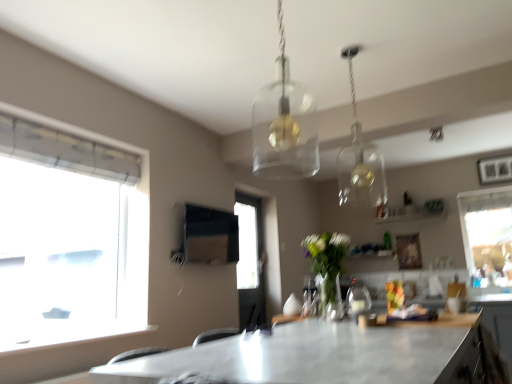
Question: Is transparent glass window at right positioned beyond the bounds of clear glass vase at center?

Choices:
 (A) no
 (B) yes

Answer: (B)

Question: Is transparent glass window at right positioned behind clear glass vase at center?

Choices:
 (A) no
 (B) yes

Answer: (B)

Question: From a real-world perspective, is transparent glass window at right over clear glass vase at center?

Choices:
 (A) no
 (B) yes

Answer: (B)

Question: Does transparent glass window at right have a greater width compared to clear glass vase at center?

Choices:
 (A) no
 (B) yes

Answer: (A)

Question: From the image's perspective, is transparent glass window at right below clear glass vase at center?

Choices:
 (A) no
 (B) yes

Answer: (B)

Question: Relative to metallic gray table at center, is matte black cabinet at lower right in front or behind?

Choices:
 (A) front
 (B) behind

Answer: (B)

Question: Considering the positions of matte black cabinet at lower right and metallic gray table at center in the image, is matte black cabinet at lower right bigger or smaller than metallic gray table at center?

Choices:
 (A) big
 (B) small

Answer: (B)

Question: In terms of width, does matte black cabinet at lower right look wider or thinner when compared to metallic gray table at center?

Choices:
 (A) wide
 (B) thin

Answer: (B)

Question: Is matte black cabinet at lower right inside or outside of metallic gray table at center?

Choices:
 (A) inside
 (B) outside

Answer: (B)

Question: Is metallic gray table at center spatially inside clear glass pendant light at upper center, the 2th lamp from the left, or outside of it?

Choices:
 (A) inside
 (B) outside

Answer: (B)

Question: From a real-world perspective, relative to clear glass pendant light at upper center, which is counted as the second lamp, starting from the front, is metallic gray table at center vertically above or below?

Choices:
 (A) below
 (B) above

Answer: (A)

Question: From their relative heights in the image, would you say metallic gray table at center is taller or shorter than clear glass pendant light at upper center, positioned as the 1th lamp in back-to-front order?

Choices:
 (A) short
 (B) tall

Answer: (A)

Question: In terms of width, does metallic gray table at center look wider or thinner when compared to clear glass pendant light at upper center, which appears as the 1th lamp when viewed from the right?

Choices:
 (A) thin
 (B) wide

Answer: (B)

Question: Considering the positions of matte black cabinet at lower right and clear glass vase at center in the image, is matte black cabinet at lower right taller or shorter than clear glass vase at center?

Choices:
 (A) short
 (B) tall

Answer: (A)

Question: From a real-world perspective, is matte black cabinet at lower right positioned above or below clear glass vase at center?

Choices:
 (A) above
 (B) below

Answer: (B)